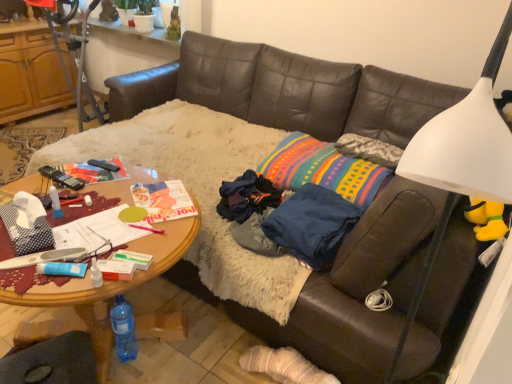
Identify the location of vacant space situated above woodendesk at center (from a real-world perspective). (102, 216).